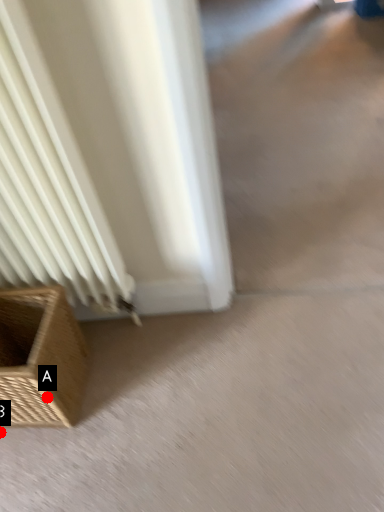
Question: Two points are circled on the image, labeled by A and B beside each circle. Which point appears farthest from the camera in this image?

Choices:
 (A) A is further
 (B) B is further

Answer: (B)